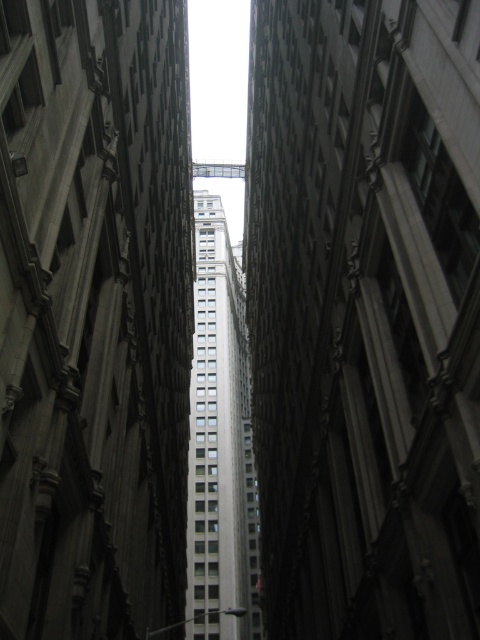
What do you see at coordinates (94, 316) in the screenshot? The height and width of the screenshot is (640, 480). I see `gray concrete skyscraper at center` at bounding box center [94, 316].

The image size is (480, 640). I want to click on gray concrete skyscraper at center, so click(x=94, y=316).

This screenshot has height=640, width=480. In order to click on gray concrete skyscraper at center in this screenshot , I will do `click(94, 316)`.

Does smooth concrete building at center appear on the left side of gray concrete skyscraper at center?

Incorrect, smooth concrete building at center is not on the left side of gray concrete skyscraper at center.

Which is behind, point (334, 275) or point (34, 186)?

Positioned behind is point (334, 275).

What are the coordinates of `smooth concrete building at center` in the screenshot? It's located at (364, 314).

Which of these two, smooth concrete building at center or white marble skyscraper at center, stands shorter?

With less height is smooth concrete building at center.

Does smooth concrete building at center lie behind white marble skyscraper at center?

No, it is not.

Between point (432, 264) and point (239, 353), which one is positioned in front?

Point (432, 264) is in front.

Locate an element on the screen. This screenshot has height=640, width=480. smooth concrete building at center is located at coordinates (364, 314).